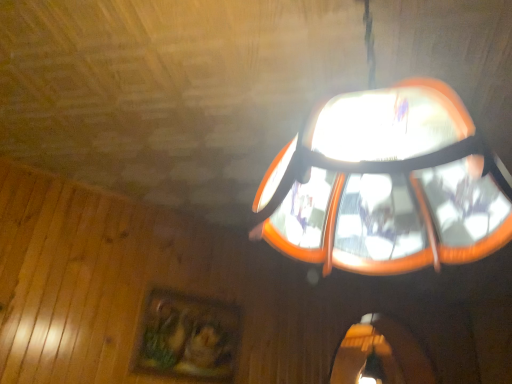
Question: Are wooden painted picture frame at lower left and orange plastic lampshade at upper center making contact?

Choices:
 (A) yes
 (B) no

Answer: (B)

Question: Is wooden painted picture frame at lower left smaller than orange plastic lampshade at upper center?

Choices:
 (A) yes
 (B) no

Answer: (A)

Question: From the image's perspective, is wooden painted picture frame at lower left above orange plastic lampshade at upper center?

Choices:
 (A) yes
 (B) no

Answer: (B)

Question: Does wooden painted picture frame at lower left have a lesser height compared to orange plastic lampshade at upper center?

Choices:
 (A) no
 (B) yes

Answer: (B)

Question: Is orange plastic lampshade at upper center located within wooden painted picture frame at lower left?

Choices:
 (A) no
 (B) yes

Answer: (A)

Question: Is wooden painted picture frame at lower left far away from orange plastic lampshade at upper center?

Choices:
 (A) yes
 (B) no

Answer: (A)

Question: Considering the relative positions of orange plastic lampshade at upper center and wooden painted picture frame at lower left in the image provided, is orange plastic lampshade at upper center behind wooden painted picture frame at lower left?

Choices:
 (A) no
 (B) yes

Answer: (A)

Question: From a real-world perspective, does orange plastic lampshade at upper center stand above wooden painted picture frame at lower left?

Choices:
 (A) no
 (B) yes

Answer: (B)

Question: Is orange plastic lampshade at upper center smaller than wooden painted picture frame at lower left?

Choices:
 (A) yes
 (B) no

Answer: (B)

Question: Is the position of orange plastic lampshade at upper center less distant than that of wooden painted picture frame at lower left?

Choices:
 (A) yes
 (B) no

Answer: (A)

Question: Considering the relative sizes of orange plastic lampshade at upper center and wooden painted picture frame at lower left in the image provided, is orange plastic lampshade at upper center wider than wooden painted picture frame at lower left?

Choices:
 (A) yes
 (B) no

Answer: (A)

Question: Is orange plastic lampshade at upper center shorter than wooden painted picture frame at lower left?

Choices:
 (A) yes
 (B) no

Answer: (B)

Question: In terms of width, does wooden painted picture frame at lower left look wider or thinner when compared to orange plastic lampshade at upper center?

Choices:
 (A) wide
 (B) thin

Answer: (B)